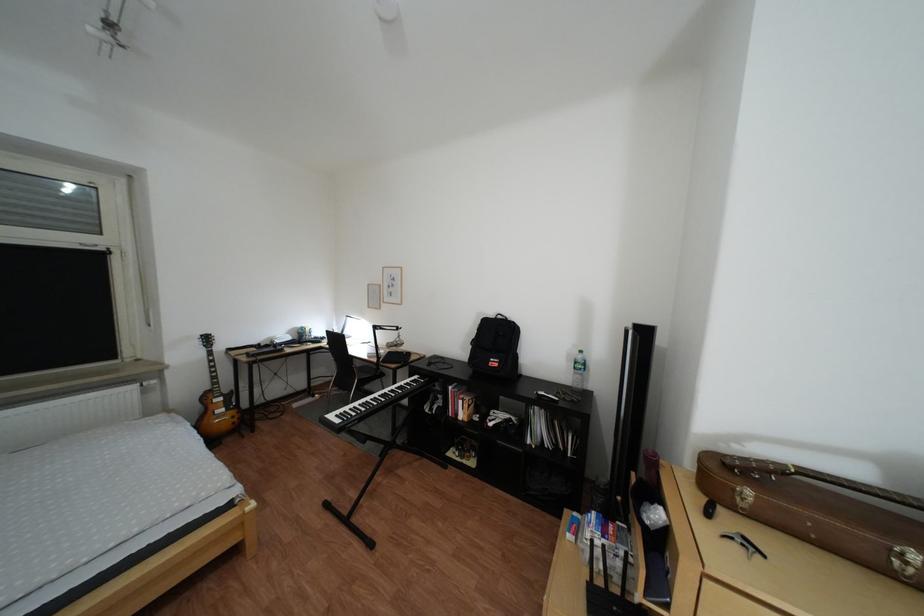
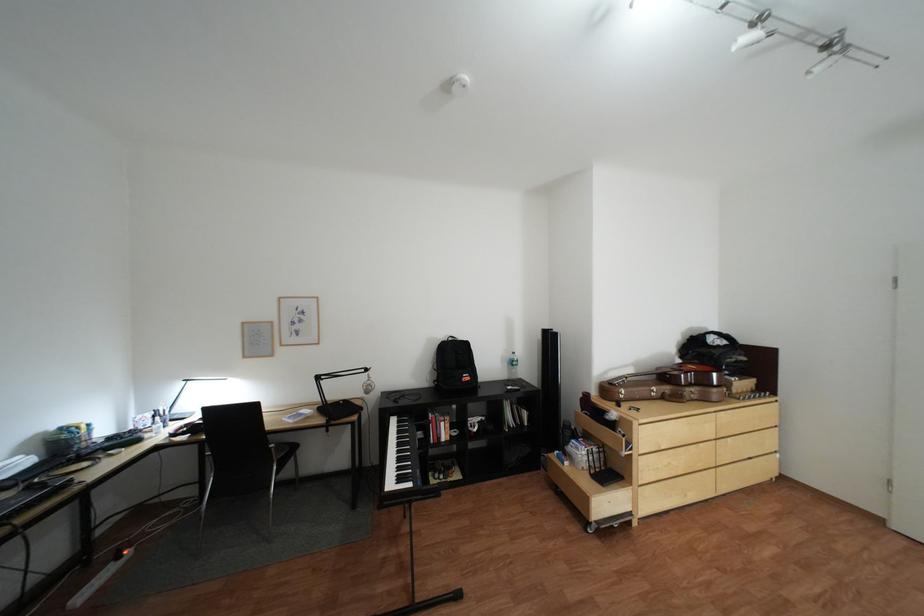
Locate, in the second image, the point that corresponds to the point at 515,318 in the first image.

(466, 339)